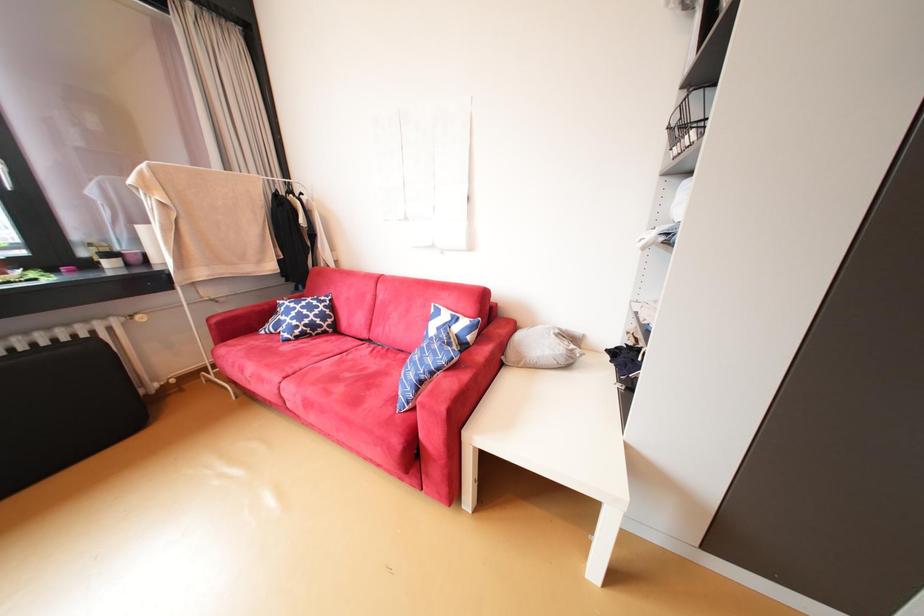
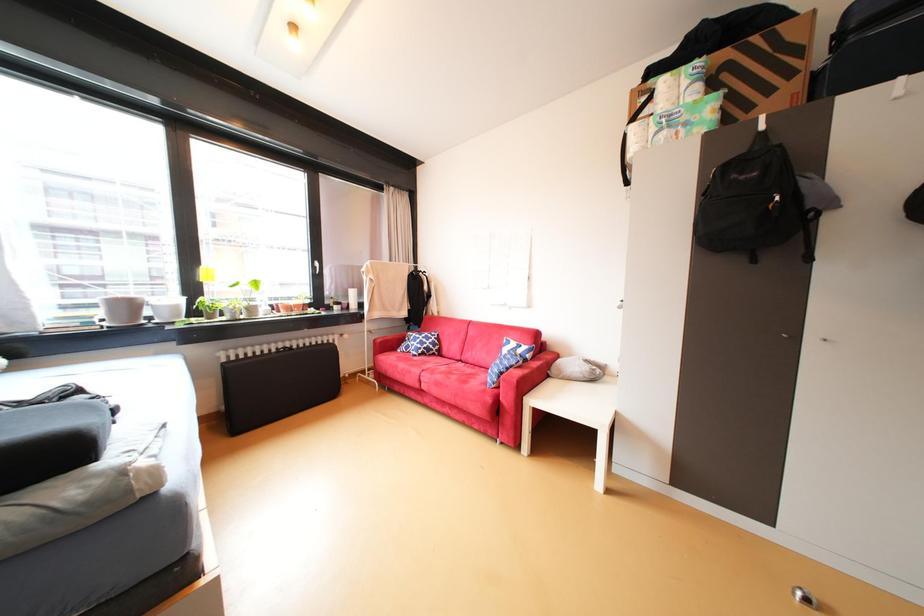
Question: What movement of the cameraman would produce the second image?

Choices:
 (A) Left
 (B) Right
 (C) Forward
 (D) Backward

Answer: (D)